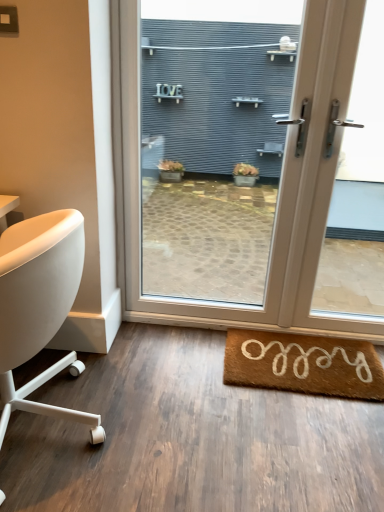
Question: Considering the relative sizes of brown coir mat at lower right and white plastic door at center in the image provided, is brown coir mat at lower right smaller than white plastic door at center?

Choices:
 (A) yes
 (B) no

Answer: (A)

Question: Does brown coir mat at lower right have a lesser width compared to white plastic door at center?

Choices:
 (A) no
 (B) yes

Answer: (A)

Question: From the image's perspective, is brown coir mat at lower right beneath white plastic door at center?

Choices:
 (A) yes
 (B) no

Answer: (A)

Question: Considering the relative sizes of brown coir mat at lower right and white plastic door at center in the image provided, is brown coir mat at lower right bigger than white plastic door at center?

Choices:
 (A) yes
 (B) no

Answer: (B)

Question: From a real-world perspective, is brown coir mat at lower right positioned under white plastic door at center based on gravity?

Choices:
 (A) yes
 (B) no

Answer: (A)

Question: In the image, is white glossy door at center positioned in front of or behind brown coir mat at lower right?

Choices:
 (A) behind
 (B) front

Answer: (B)

Question: From a real-world perspective, is white glossy door at center physically located above or below brown coir mat at lower right?

Choices:
 (A) above
 (B) below

Answer: (A)

Question: Is white glossy door at center spatially inside brown coir mat at lower right, or outside of it?

Choices:
 (A) inside
 (B) outside

Answer: (B)

Question: Considering the positions of white glossy door at center and brown coir mat at lower right in the image, is white glossy door at center wider or thinner than brown coir mat at lower right?

Choices:
 (A) wide
 (B) thin

Answer: (B)

Question: Considering the positions of white plastic door at center and white leather chair at left in the image, is white plastic door at center wider or thinner than white leather chair at left?

Choices:
 (A) wide
 (B) thin

Answer: (B)

Question: From the image's perspective, is white plastic door at center above or below white leather chair at left?

Choices:
 (A) below
 (B) above

Answer: (B)

Question: Visually, is white plastic door at center positioned to the left or to the right of white leather chair at left?

Choices:
 (A) left
 (B) right

Answer: (B)

Question: Looking at the image, does white plastic door at center seem bigger or smaller compared to white leather chair at left?

Choices:
 (A) big
 (B) small

Answer: (B)

Question: From a real-world perspective, is white plastic door at center physically located above or below white glossy door at center?

Choices:
 (A) below
 (B) above

Answer: (A)

Question: Is point (365, 165) positioned closer to the camera than point (379, 330)?

Choices:
 (A) farther
 (B) closer

Answer: (A)